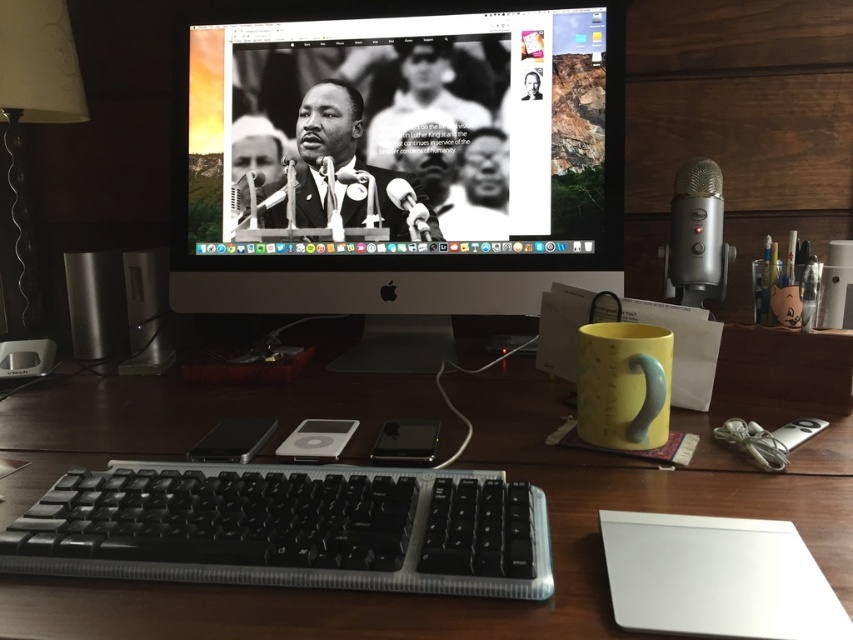
You are setting up a new plant stand that needs to be placed between the wooden at center and the satin black speaker at left. Since the plant stand requires a minimum of 20 cm of vertical space, can it fit between them?

The wooden at center is much taller than the satin black speaker at left, so the vertical space between them is sufficient for the plant stand requiring 20 cm of vertical space.

What is located at the coordinates point (x=410, y=120) on the desk?

The black matte monitor at center is located at point (x=410, y=120).

You are sitting at the desk looking at the Apple iMac monitor. There are two points marked on the desk. One is at coordinate point (22, 509) and the other at point (338, 195). Which point is closer to you?

Point (22, 509) is in front of point (338, 195), so it is closer to you.